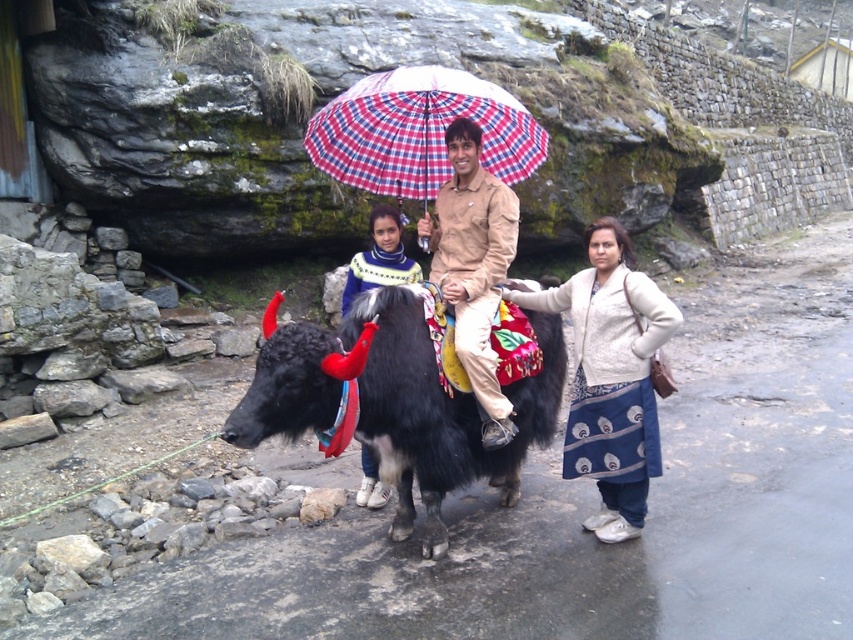
Can you confirm if plaid fabric umbrella at center is positioned to the right of beige cotton shirt at center?

In fact, plaid fabric umbrella at center is to the left of beige cotton shirt at center.

Does plaid fabric umbrella at center appear under beige cotton shirt at center?

No, plaid fabric umbrella at center is not below beige cotton shirt at center.

This screenshot has height=640, width=853. I want to click on plaid fabric umbrella at center, so click(x=419, y=131).

The height and width of the screenshot is (640, 853). I want to click on plaid fabric umbrella at center, so click(x=419, y=131).

Between blue printed dress at right and knitted sweater at center, which one appears on the left side from the viewer's perspective?

knitted sweater at center

Which is in front, point (630, 536) or point (369, 214)?

Point (630, 536) is in front.

The width and height of the screenshot is (853, 640). Find the location of `blue printed dress at right`. blue printed dress at right is located at coordinates (610, 376).

Is black fuzzy yak at center to the left of blue printed dress at right from the viewer's perspective?

Indeed, black fuzzy yak at center is positioned on the left side of blue printed dress at right.

Between point (505, 499) and point (648, 348), which one is positioned in front?

Point (648, 348) is in front.

At what (x,y) coordinates should I click in order to perform the action: click on black fuzzy yak at center. Please return your answer as a coordinate pair (x, y). This screenshot has height=640, width=853. Looking at the image, I should click on (397, 403).